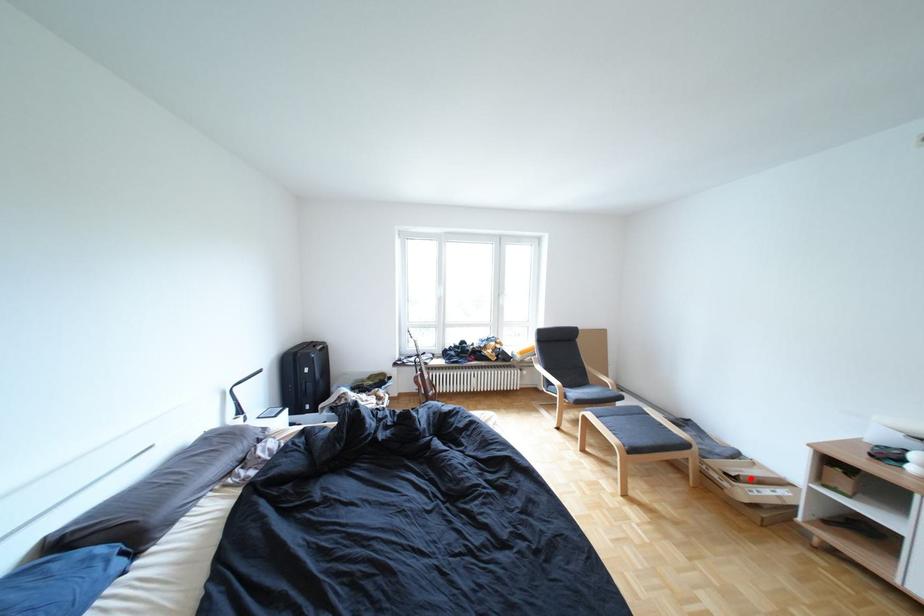
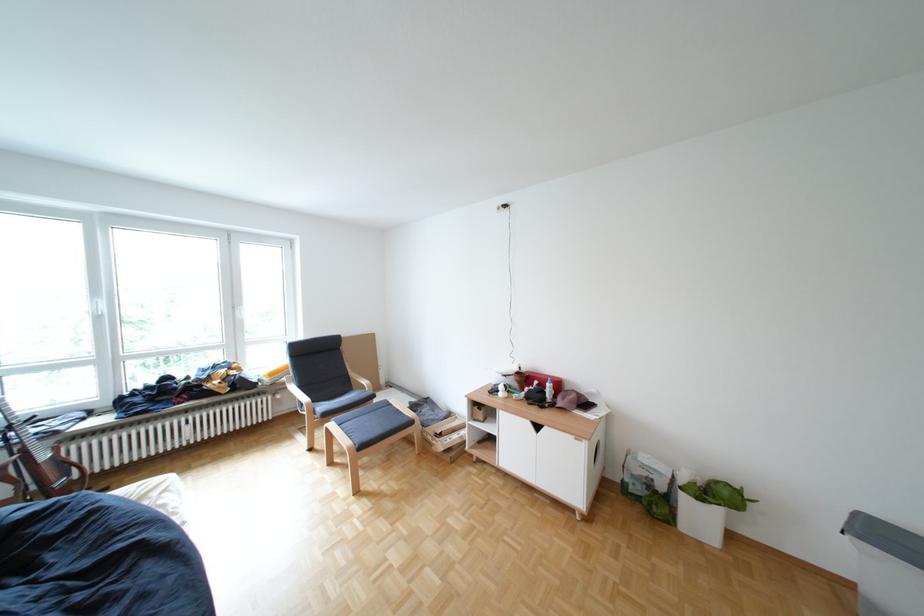
Question: A red point is marked in image1. In image2, is the corresponding 3D point closer to the camera or farther? Reply with the corresponding letter.

Choices:
 (A) The corresponding 3D point is closer.
 (B) The corresponding 3D point is farther.

Answer: (A)